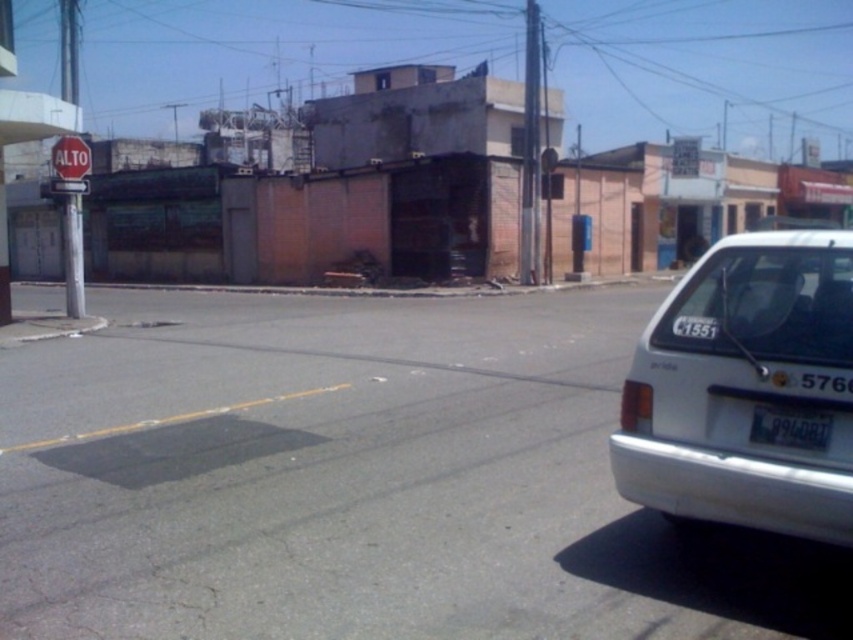
You are a delivery driver who needs to read the license plate number of the black plastic license plate at lower right. Can you see the license plate clearly from your current position?

The black plastic license plate at lower right is located at point (790, 428) in the image, so it is visible and can be read clearly from your current position.

You are a self driving car trying to identify license plates in the scene. There is a point at coordinate (790, 428). Which object is this point located on?

The point at coordinate (790, 428) is located on the black plastic license plate at lower right.